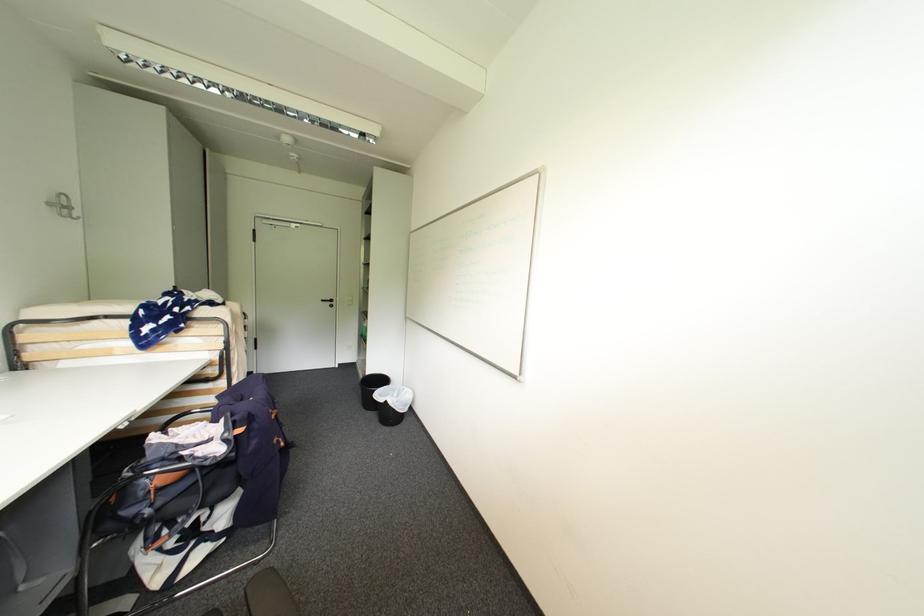
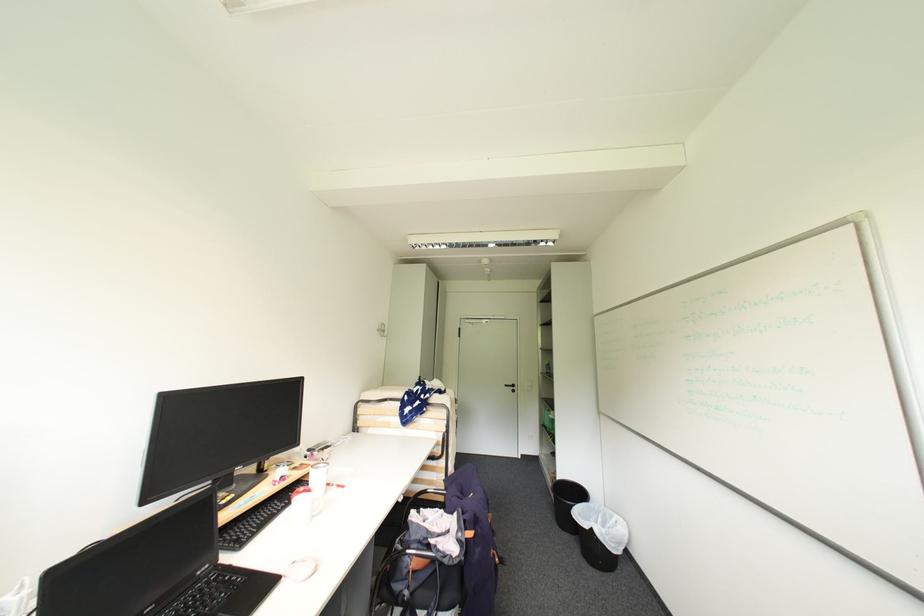
In the second image, find the point that corresponds to point 55,205 in the first image.

(384, 331)